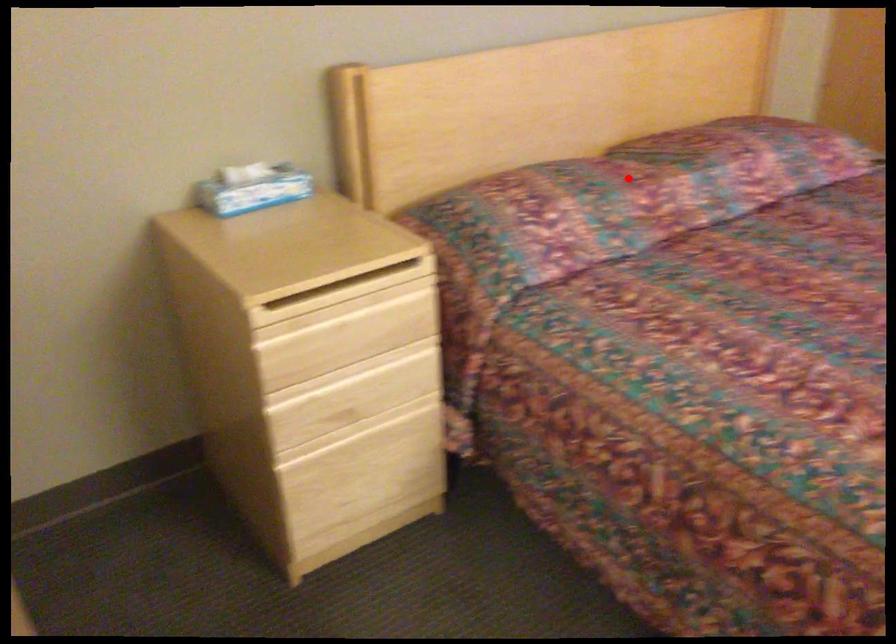
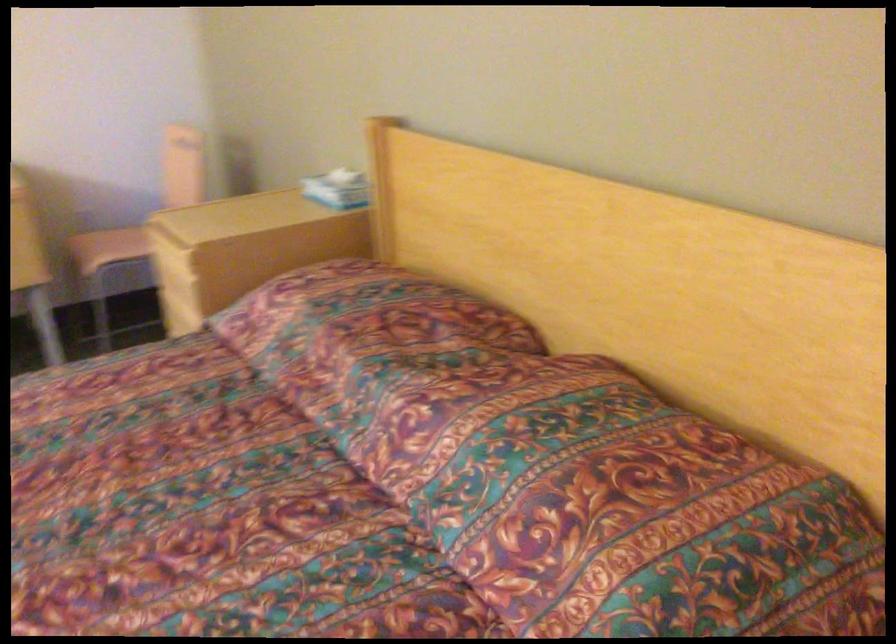
Question: A red point is marked in image1. In image2, is the corresponding 3D point closer to the camera or farther? Reply with the corresponding letter.

Choices:
 (A) The corresponding 3D point is closer.
 (B) The corresponding 3D point is farther.

Answer: (A)